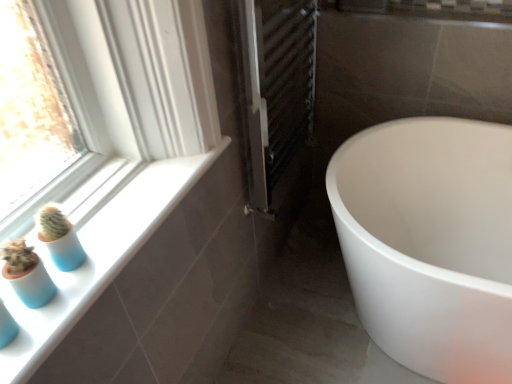
Question: Is white glossy tub at lower right at the right side of blue matte glass vase at lower left?

Choices:
 (A) yes
 (B) no

Answer: (A)

Question: From a real-world perspective, is white glossy tub at lower right under blue matte glass vase at lower left?

Choices:
 (A) no
 (B) yes

Answer: (B)

Question: Is white glossy tub at lower right thinner than blue matte glass vase at lower left?

Choices:
 (A) yes
 (B) no

Answer: (B)

Question: Is the position of white glossy tub at lower right less distant than that of blue matte glass vase at lower left?

Choices:
 (A) yes
 (B) no

Answer: (B)

Question: Is white glossy tub at lower right beside blue matte glass vase at lower left?

Choices:
 (A) yes
 (B) no

Answer: (B)

Question: Is metallic silver radiator at center situated inside white glossy window sill at lower left or outside?

Choices:
 (A) inside
 (B) outside

Answer: (B)

Question: In terms of size, does metallic silver radiator at center appear bigger or smaller than white glossy window sill at lower left?

Choices:
 (A) big
 (B) small

Answer: (A)

Question: In the image, is metallic silver radiator at center positioned in front of or behind white glossy window sill at lower left?

Choices:
 (A) behind
 (B) front

Answer: (A)

Question: From the image's perspective, relative to white glossy window sill at lower left, is metallic silver radiator at center above or below?

Choices:
 (A) below
 (B) above

Answer: (B)

Question: In terms of width, does metallic silver radiator at center look wider or thinner when compared to white glossy tub at lower right?

Choices:
 (A) thin
 (B) wide

Answer: (A)

Question: In the image, is metallic silver radiator at center positioned in front of or behind white glossy tub at lower right?

Choices:
 (A) behind
 (B) front

Answer: (A)

Question: Considering the relative positions of metallic silver radiator at center and white glossy tub at lower right in the image provided, is metallic silver radiator at center to the left or to the right of white glossy tub at lower right?

Choices:
 (A) right
 (B) left

Answer: (B)

Question: From the image's perspective, is metallic silver radiator at center located above or below white glossy tub at lower right?

Choices:
 (A) below
 (B) above

Answer: (B)

Question: From the image's perspective, is white glossy window sill at lower left located above or below white glossy tub at lower right?

Choices:
 (A) above
 (B) below

Answer: (A)

Question: Is white glossy window sill at lower left bigger or smaller than white glossy tub at lower right?

Choices:
 (A) small
 (B) big

Answer: (A)